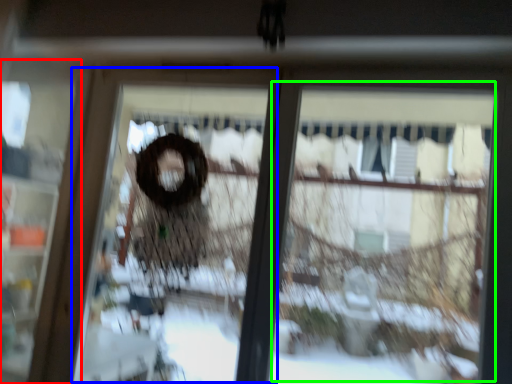
Question: Which object is the farthest from screen door (highlighted by a red box)? Choose among these: screen door (highlighted by a blue box) or shop window (highlighted by a green box).

Choices:
 (A) screen door
 (B) shop window

Answer: (B)